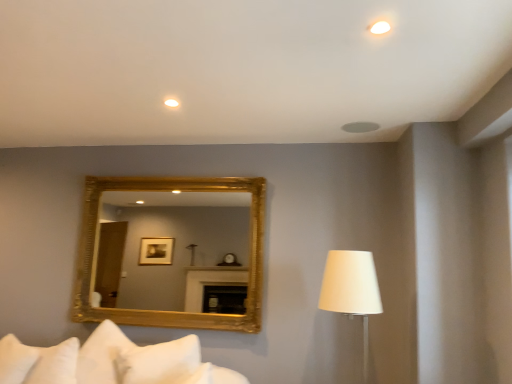
Locate an element on the screen. This screenshot has width=512, height=384. vacant space situated on the left part of white matte ceiling light at upper center, the 1th lighting positioned from the top is located at coordinates (335, 23).